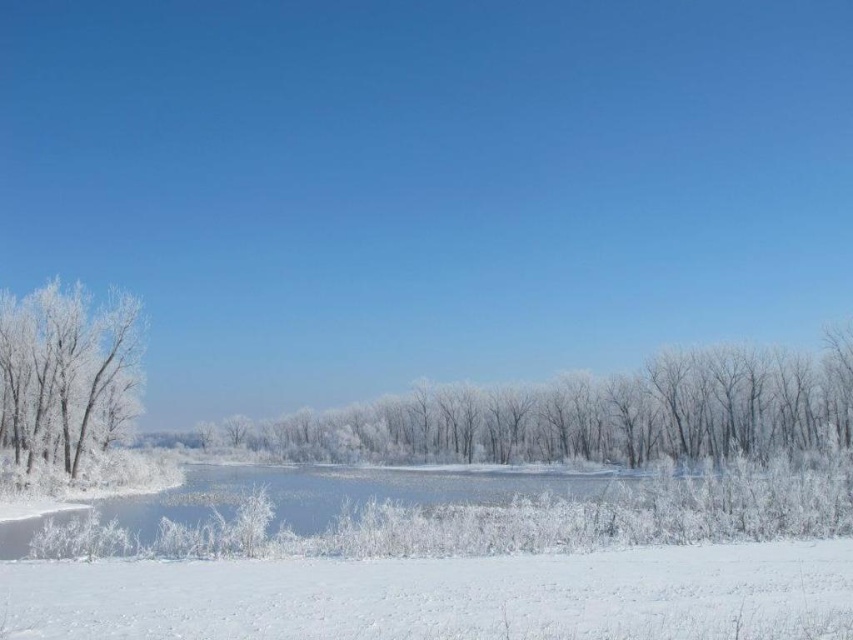
Which is behind, point (338, 605) or point (646, 372)?

Point (646, 372)

Is white fluffy snow at lower center below white frosty trees at center?

Actually, white fluffy snow at lower center is above white frosty trees at center.

Is point (592, 554) positioned after point (252, 436)?

No, it is in front of (252, 436).

The width and height of the screenshot is (853, 640). I want to click on white fluffy snow at lower center, so click(x=444, y=596).

Between point (42, 618) and point (115, 330), which one is positioned in front?

Positioned in front is point (42, 618).

Between white fluffy snow at lower center and frosted glass tree at left, which one is positioned lower?

frosted glass tree at left is below.

Which is in front, point (573, 582) or point (57, 390)?

Point (573, 582) is in front.

You are a GUI agent. You are given a task and a screenshot of the screen. Output one action in this format:
    pyautogui.click(x=<x>, y=<y>)
    Task: Click on the white fluffy snow at lower center
    
    Given the screenshot: What is the action you would take?
    pyautogui.click(x=444, y=596)

Can you confirm if white frosty trees at center is wider than frosted glass tree at left?

Yes.

Is point (750, 349) behind point (107, 388)?

That is True.

Where is `white frosty trees at center`? The height and width of the screenshot is (640, 853). white frosty trees at center is located at coordinates (585, 416).